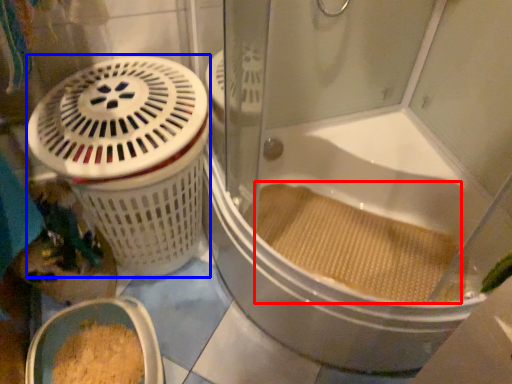
Question: Which point is further to the camera, debris (highlighted by a red box) or basket container (highlighted by a blue box)?

Choices:
 (A) debris
 (B) basket container

Answer: (A)